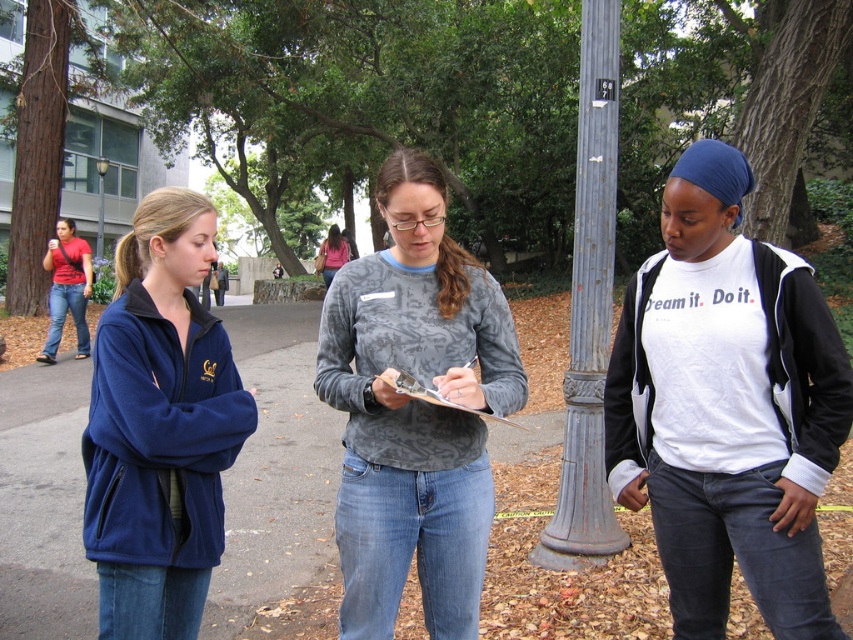
Can you confirm if gray textured sweatshirt at center is bigger than brushed metal lamp post at upper center?

Actually, gray textured sweatshirt at center might be smaller than brushed metal lamp post at upper center.

Does gray textured sweatshirt at center appear on the right side of brushed metal lamp post at upper center?

Correct, you'll find gray textured sweatshirt at center to the right of brushed metal lamp post at upper center.

Where is `gray textured sweatshirt at center`? gray textured sweatshirt at center is located at coordinates (413, 360).

Between blue fleece jacket at left and matte pink shirt at center, which one is positioned lower?

Positioned lower is blue fleece jacket at left.

Locate an element on the screen. blue fleece jacket at left is located at coordinates (160, 426).

The image size is (853, 640). What are the coordinates of `gray textured sweatshirt at center` in the screenshot? It's located at (413, 360).

Is point (340, 376) less distant than point (341, 248)?

Yes.

What do you see at coordinates (413, 360) in the screenshot? This screenshot has height=640, width=853. I see `gray textured sweatshirt at center` at bounding box center [413, 360].

This screenshot has height=640, width=853. In order to click on gray textured sweatshirt at center in this screenshot , I will do `click(413, 360)`.